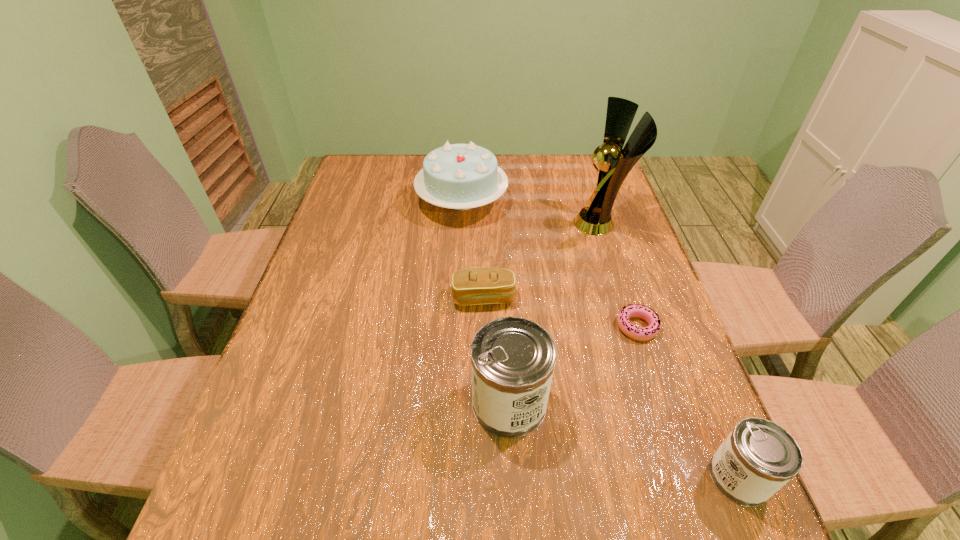
This screenshot has height=540, width=960. In order to click on doughnut present at the right edge in this screenshot , I will do `click(645, 313)`.

Where is `award positioned at the right edge`? The height and width of the screenshot is (540, 960). award positioned at the right edge is located at coordinates (615, 162).

At what (x,y) coordinates should I click in order to perform the action: click on object at the near right corner. Please return your answer as a coordinate pair (x, y). Looking at the image, I should click on (758, 457).

Locate an element on the screen. This screenshot has height=540, width=960. vacant space at the far edge of the desktop is located at coordinates (542, 160).

Image resolution: width=960 pixels, height=540 pixels. I want to click on vacant region at the left edge of the desktop, so click(x=328, y=354).

Identify the location of vacant area at the right edge of the desktop. This screenshot has height=540, width=960. (637, 267).

This screenshot has height=540, width=960. What are the coordinates of `free space at the far left corner of the desktop` in the screenshot? It's located at click(x=372, y=180).

Find the location of `vacant space at the far right corner of the desktop`. vacant space at the far right corner of the desktop is located at coordinates (590, 170).

This screenshot has width=960, height=540. Find the location of `vacant space at the near right corner`. vacant space at the near right corner is located at coordinates (670, 460).

Identify the location of vacant space in between the farther can and the tallest object. Image resolution: width=960 pixels, height=540 pixels. pos(555,313).